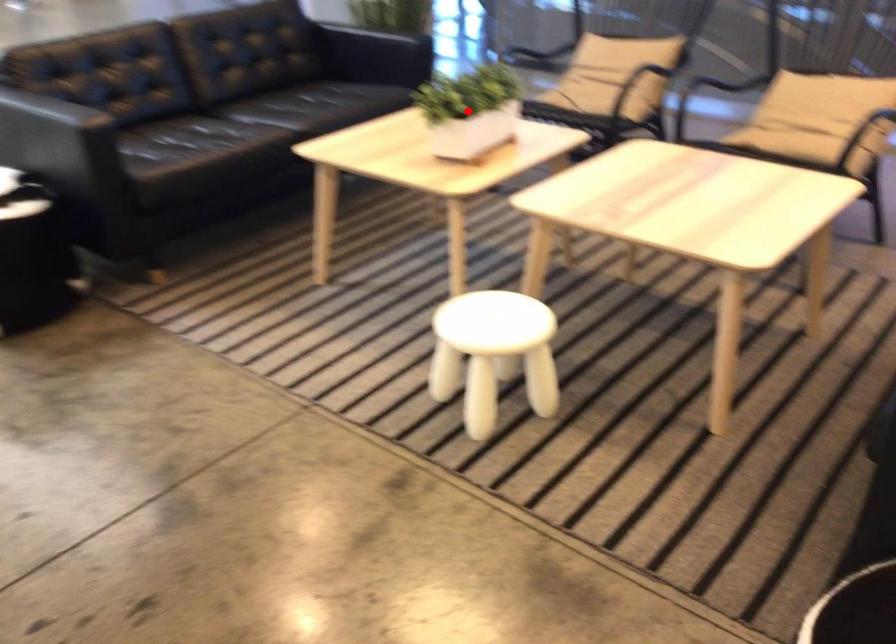
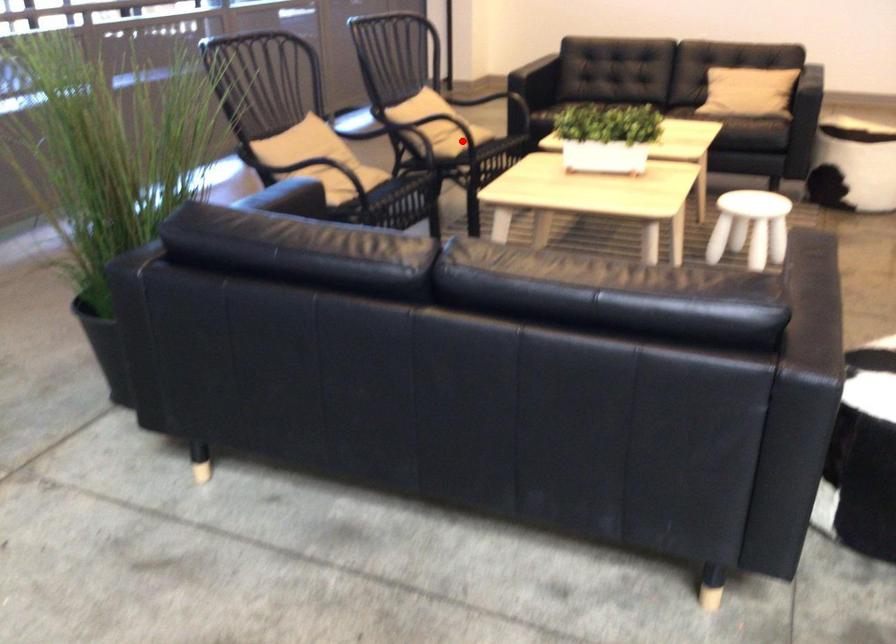
I am providing you with two images of the same scene from different viewpoints. A red point is marked on the first image and another point is marked on the second image. Is the marked point in image1 the same physical position as the marked point in image2?

No